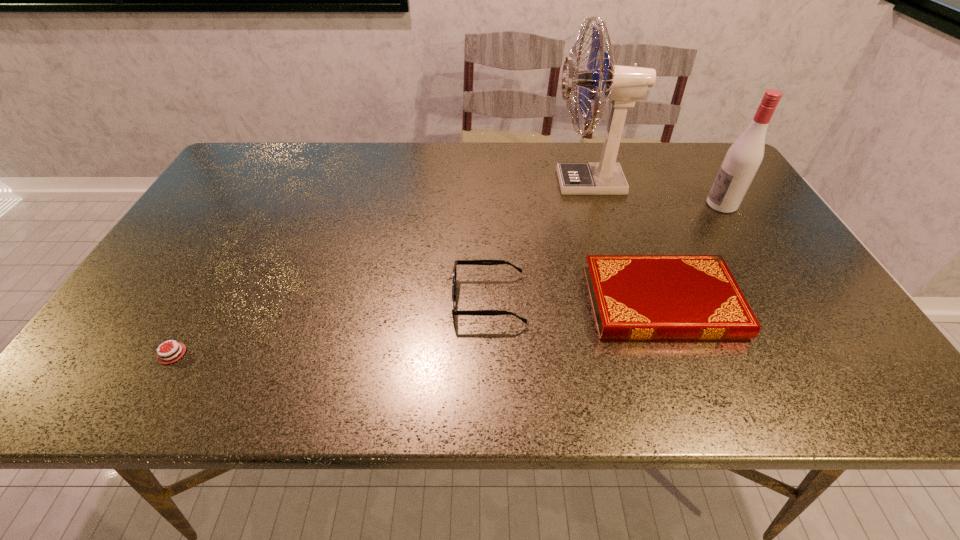
Locate an element on the screen. This screenshot has width=960, height=540. vacant space located on the back of the shortest object is located at coordinates (250, 219).

Locate an element on the screen. object that is positioned at the far edge is located at coordinates (624, 85).

I want to click on object positioned at the near edge, so click(168, 358).

You are a GUI agent. You are given a task and a screenshot of the screen. Output one action in this format:
    pyautogui.click(x=<x>, y=<y>)
    Task: Click on the object at the left edge
    
    Given the screenshot: What is the action you would take?
    pyautogui.click(x=168, y=358)

Locate an element on the screen. object located at the right edge is located at coordinates (744, 157).

You are a GUI agent. You are given a task and a screenshot of the screen. Output one action in this format:
    pyautogui.click(x=<x>, y=<y>)
    Task: Click on the object positioned at the near left corner
    
    Given the screenshot: What is the action you would take?
    pyautogui.click(x=168, y=358)

Find the location of a particular element. Image resolution: width=960 pixels, height=540 pixels. free space at the far edge of the desktop is located at coordinates (550, 183).

I want to click on vacant space at the near edge of the desktop, so click(505, 388).

This screenshot has height=540, width=960. Identify the location of free location at the right edge. (777, 239).

This screenshot has width=960, height=540. In the image, there is a desktop. What are the coordinates of `vacant region at the far left corner` in the screenshot? It's located at (232, 170).